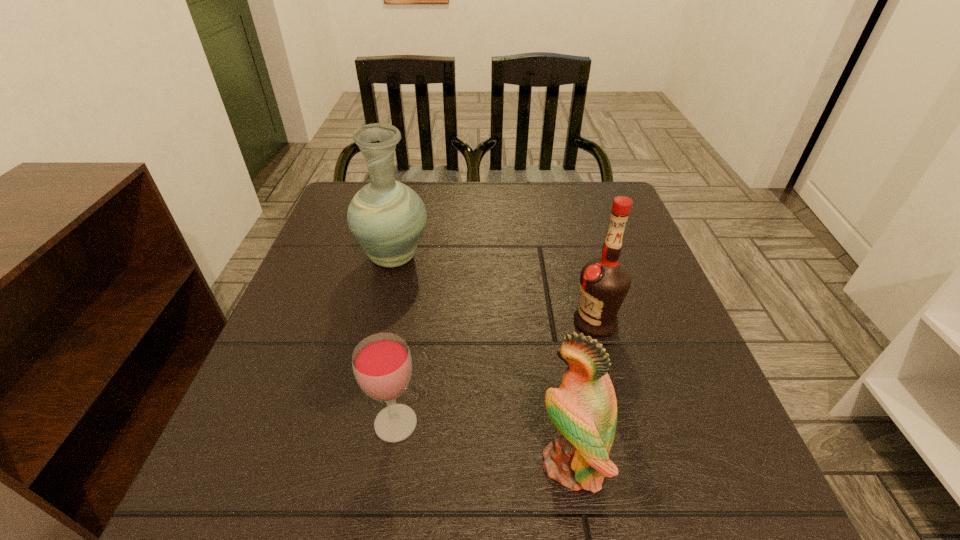
Locate which object is the third closest to the parrot. Please provide its 2D coordinates. Your answer should be formatted as a tuple, i.e. [(x, y)], where the tuple contains the x and y coordinates of a point satisfying the conditions above.

[(387, 218)]